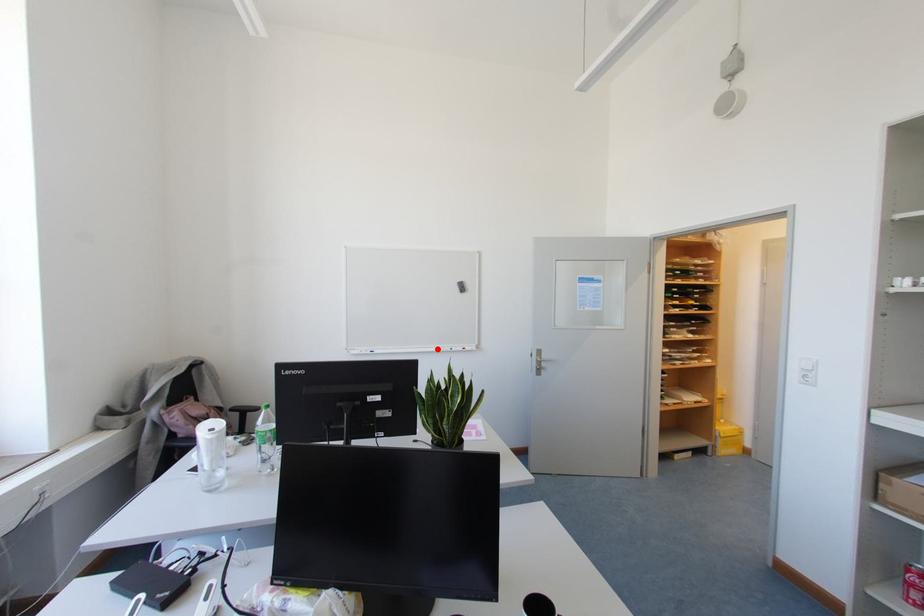
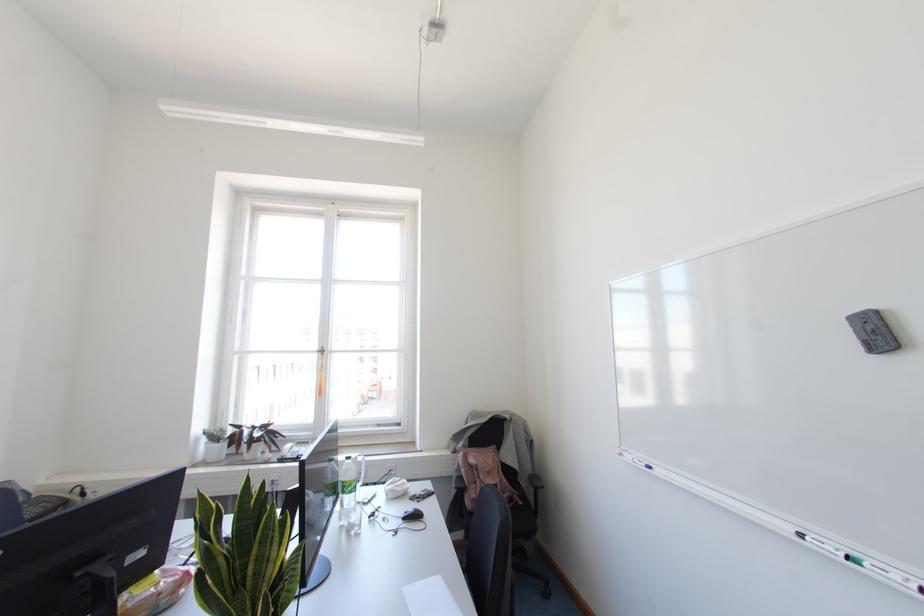
The point at the highlighted location is marked in the first image. Where is the corresponding point in the second image?

(800, 536)